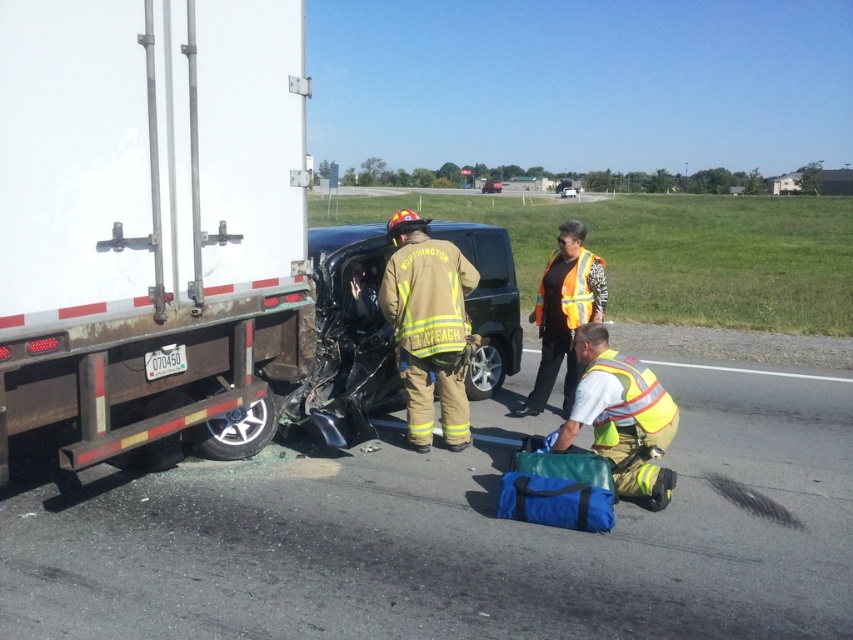
Question: Which object is farther from the camera taking this photo?

Choices:
 (A) reflective yellow fire gear at center
 (B) white matte truck at left
 (C) black matte car at center
 (D) yellow reflective vest at lower right

Answer: (C)

Question: Which of these objects is positioned farthest from the black glossy car at center?

Choices:
 (A) reflective yellow fire gear at center
 (B) yellow reflective vest at lower right

Answer: (A)

Question: Which object is positioned farthest from the black glossy car at center?

Choices:
 (A) yellow reflective vest at lower right
 (B) orange reflective vest at center
 (C) reflective yellow fire gear at center
 (D) black matte car at center

Answer: (C)

Question: Does black matte car at center have a larger size compared to yellow reflective vest at lower right?

Choices:
 (A) no
 (B) yes

Answer: (A)

Question: From the image, what is the correct spatial relationship of black matte car at center in relation to yellow reflective vest at lower right?

Choices:
 (A) below
 (B) above

Answer: (B)

Question: Can you confirm if reflective yellow fire gear at center is smaller than orange reflective vest at center?

Choices:
 (A) yes
 (B) no

Answer: (A)